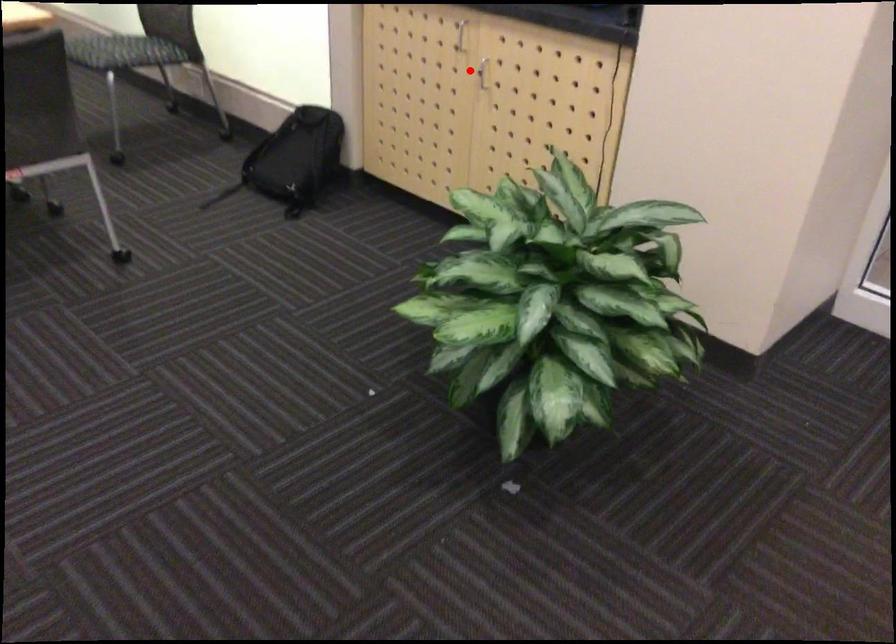
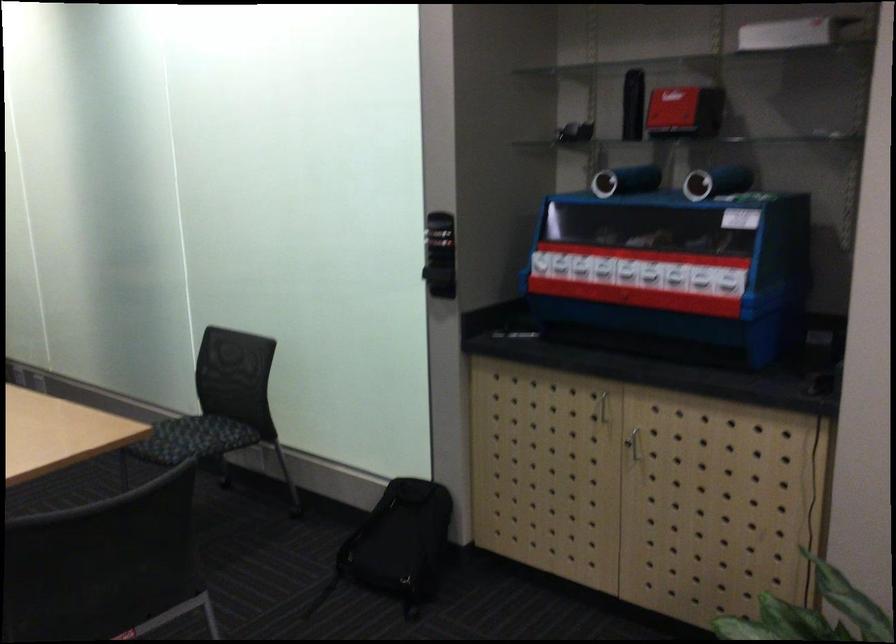
Find the pixel in the second image that matches the highlighted location in the first image.

(633, 442)